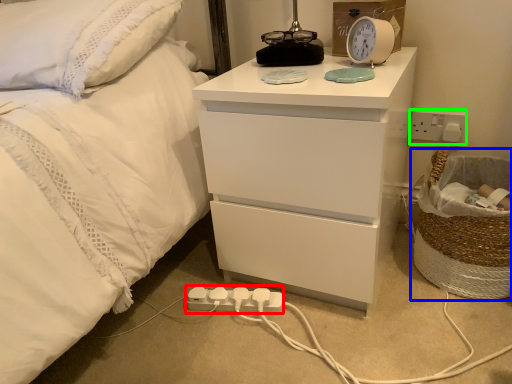
Question: Which object is the farthest from extension cord (highlighted by a red box)? Choose among these: laundry basket (highlighted by a blue box) or electric outlet (highlighted by a green box).

Choices:
 (A) laundry basket
 (B) electric outlet

Answer: (B)